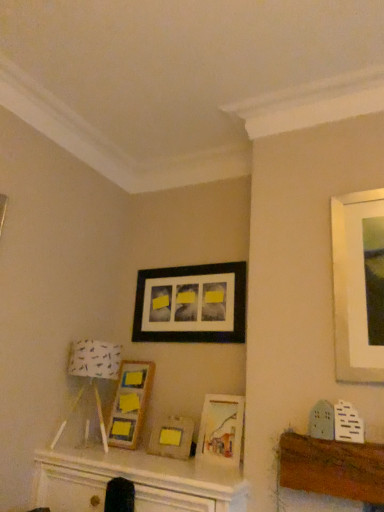
Identify the location of white fabric lampshade at left. The width and height of the screenshot is (384, 512). (91, 376).

This screenshot has height=512, width=384. Identify the location of wooden frame at center, the second picture frame positioned from the top. (130, 403).

The width and height of the screenshot is (384, 512). Describe the element at coordinates (221, 429) in the screenshot. I see `matte wooden picture frame at center, the second picture frame from the bottom` at that location.

Locate an element on the screen. The image size is (384, 512). white fabric lampshade at left is located at coordinates (91, 376).

Could you tell me if matte wooden picture frame at center, which is counted as the third picture frame, starting from the top, is turned towards black matte picture frame at upper center, which ranks as the 1th picture frame in top-to-bottom order?

No, matte wooden picture frame at center, which is counted as the third picture frame, starting from the top, is not turned towards black matte picture frame at upper center, which ranks as the 1th picture frame in top-to-bottom order.

How many degrees apart are the facing directions of matte wooden picture frame at center, the second picture frame from the bottom, and black matte picture frame at upper center, which ranks as the 4th picture frame in bottom-to-top order?

The angular difference between matte wooden picture frame at center, the second picture frame from the bottom, and black matte picture frame at upper center, which ranks as the 4th picture frame in bottom-to-top order, is 3.96 degrees.

From the image's perspective, count 2nd picture frames downward from the black matte picture frame at upper center, which ranks as the 4th picture frame in bottom-to-top order, and point to it. Please provide its 2D coordinates.

[(221, 429)]

Based on the photo, which object is further away from the camera, matte wooden picture frame at center, the second picture frame from the bottom, or black matte picture frame at upper center, which ranks as the 4th picture frame in bottom-to-top order?

black matte picture frame at upper center, which ranks as the 4th picture frame in bottom-to-top order, is behind.

Which is further, (143, 316) or (100, 361)?

The point (143, 316) is farther.

What's the angular difference between black matte picture frame at upper center, which ranks as the 4th picture frame in bottom-to-top order, and white fabric lampshade at left's facing directions?

There is a 5.44-degree angle between the facing directions of black matte picture frame at upper center, which ranks as the 4th picture frame in bottom-to-top order, and white fabric lampshade at left.

Which object is thinner, black matte picture frame at upper center, which ranks as the 4th picture frame in bottom-to-top order, or white fabric lampshade at left?

Thinner between the two is black matte picture frame at upper center, which ranks as the 4th picture frame in bottom-to-top order.

Does matte wooden picture frame at center, which is counted as the third picture frame, starting from the top, have a smaller size compared to matte silver picture frame at center, which is counted as the fourth picture frame, starting from the top?

No, matte wooden picture frame at center, which is counted as the third picture frame, starting from the top, is not smaller than matte silver picture frame at center, which is counted as the fourth picture frame, starting from the top.

Does point (205, 426) lie in front of point (155, 429)?

That is True.

Is matte wooden picture frame at center, the second picture frame from the bottom, in contact with matte silver picture frame at center, which is counted as the fourth picture frame, starting from the top?

No.

Is matte wooden picture frame at center, which is counted as the third picture frame, starting from the top, positioned with its back to matte silver picture frame at center, which is counted as the fourth picture frame, starting from the top?

No.

Is the position of white fabric lampshade at left more distant than that of matte silver picture frame at center, arranged as the first picture frame when ordered from the bottom?

No.

From the picture: Which point is more forward, (120, 356) or (150, 434)?

The point (150, 434) is closer.

Measure the distance between white fabric lampshade at left and matte silver picture frame at center, which is counted as the fourth picture frame, starting from the top.

They are 18.14 inches apart.

Is white fabric lampshade at left oriented towards matte silver picture frame at center, which is counted as the fourth picture frame, starting from the top?

No, white fabric lampshade at left is not turned towards matte silver picture frame at center, which is counted as the fourth picture frame, starting from the top.

Is black matte picture frame at upper center, which ranks as the 1th picture frame in top-to-bottom order, oriented towards matte wooden picture frame at center, which is counted as the third picture frame, starting from the top?

No, black matte picture frame at upper center, which ranks as the 1th picture frame in top-to-bottom order, is not aimed at matte wooden picture frame at center, which is counted as the third picture frame, starting from the top.

Locate an element on the screen. The height and width of the screenshot is (512, 384). the 3rd picture frame behind the matte wooden picture frame at center, which is counted as the third picture frame, starting from the top is located at coordinates (191, 304).

Between black matte picture frame at upper center, which ranks as the 1th picture frame in top-to-bottom order, and matte wooden picture frame at center, the second picture frame from the bottom, which one has larger size?

black matte picture frame at upper center, which ranks as the 1th picture frame in top-to-bottom order.

Is point (105, 429) closer or farther from the camera than point (121, 379)?

Clearly, point (105, 429) is closer to the camera than point (121, 379).

From a real-world perspective, which object rests below the other?

wooden frame at center, the second picture frame positioned from the top, is physically lower.

Can you confirm if white fabric lampshade at left is wider than wooden frame at center, the third picture frame from the bottom?

Indeed, white fabric lampshade at left has a greater width compared to wooden frame at center, the third picture frame from the bottom.

Which of these two, black matte picture frame at upper center, which ranks as the 4th picture frame in bottom-to-top order, or matte silver picture frame at center, which is counted as the fourth picture frame, starting from the top, is smaller?

With smaller size is matte silver picture frame at center, which is counted as the fourth picture frame, starting from the top.

Which is in front, point (238, 320) or point (152, 433)?

Point (152, 433)

Would you say black matte picture frame at upper center, which ranks as the 1th picture frame in top-to-bottom order, is outside matte silver picture frame at center, arranged as the first picture frame when ordered from the bottom?

black matte picture frame at upper center, which ranks as the 1th picture frame in top-to-bottom order, is positioned outside matte silver picture frame at center, arranged as the first picture frame when ordered from the bottom.

What's the angular difference between black matte picture frame at upper center, which ranks as the 4th picture frame in bottom-to-top order, and matte silver picture frame at center, arranged as the first picture frame when ordered from the bottom,'s facing directions?

black matte picture frame at upper center, which ranks as the 4th picture frame in bottom-to-top order, and matte silver picture frame at center, arranged as the first picture frame when ordered from the bottom, are facing 3.52 degrees away from each other.

Which picture frame is the 3rd one when counting from the back of the matte wooden picture frame at center, which is counted as the third picture frame, starting from the top? Please provide its 2D coordinates.

[(191, 304)]

Where is `picture frame above the white fabric lampshade at left (from the image's perspective)`? picture frame above the white fabric lampshade at left (from the image's perspective) is located at coordinates (191, 304).

Looking at the image, which one is located closer to matte silver picture frame at center, which is counted as the fourth picture frame, starting from the top, matte wooden picture frame at center, which is counted as the third picture frame, starting from the top, or black matte picture frame at upper center, which ranks as the 4th picture frame in bottom-to-top order?

Based on the image, matte wooden picture frame at center, which is counted as the third picture frame, starting from the top, appears to be nearer to matte silver picture frame at center, which is counted as the fourth picture frame, starting from the top.

From the image, which object appears to be farther from wooden frame at center, the second picture frame positioned from the top, white fabric lampshade at left or black matte picture frame at upper center, which ranks as the 1th picture frame in top-to-bottom order?

Among the two, black matte picture frame at upper center, which ranks as the 1th picture frame in top-to-bottom order, is located further to wooden frame at center, the second picture frame positioned from the top.

Based on their spatial positions, is white fabric lampshade at left or matte wooden picture frame at center, which is counted as the third picture frame, starting from the top, further from wooden frame at center, the second picture frame positioned from the top?

matte wooden picture frame at center, which is counted as the third picture frame, starting from the top.

Estimate the real-world distances between objects in this image. Which object is closer to matte wooden picture frame at center, the second picture frame from the bottom, wooden frame at center, the second picture frame positioned from the top, or matte silver picture frame at center, arranged as the first picture frame when ordered from the bottom?

matte silver picture frame at center, arranged as the first picture frame when ordered from the bottom, is positioned closer to the anchor matte wooden picture frame at center, the second picture frame from the bottom.

Considering their positions, is matte silver picture frame at center, arranged as the first picture frame when ordered from the bottom, positioned closer to white fabric lampshade at left than black matte picture frame at upper center, which ranks as the 1th picture frame in top-to-bottom order?

matte silver picture frame at center, arranged as the first picture frame when ordered from the bottom.

Which object lies further to the anchor point wooden frame at center, the third picture frame from the bottom, matte silver picture frame at center, which is counted as the fourth picture frame, starting from the top, or white fabric lampshade at left?

matte silver picture frame at center, which is counted as the fourth picture frame, starting from the top, is positioned further to the anchor wooden frame at center, the third picture frame from the bottom.

Considering their positions, is black matte picture frame at upper center, which ranks as the 1th picture frame in top-to-bottom order, positioned further to wooden frame at center, the second picture frame positioned from the top, than matte silver picture frame at center, arranged as the first picture frame when ordered from the bottom?

Based on the image, black matte picture frame at upper center, which ranks as the 1th picture frame in top-to-bottom order, appears to be further to wooden frame at center, the second picture frame positioned from the top.

From the image, which object appears to be nearer to black matte picture frame at upper center, which ranks as the 1th picture frame in top-to-bottom order, wooden frame at center, the third picture frame from the bottom, or white fabric lampshade at left?

Among the two, wooden frame at center, the third picture frame from the bottom, is located nearer to black matte picture frame at upper center, which ranks as the 1th picture frame in top-to-bottom order.

Image resolution: width=384 pixels, height=512 pixels. Identify the location of lamp between black matte picture frame at upper center, which ranks as the 4th picture frame in bottom-to-top order, and wooden frame at center, the second picture frame positioned from the top, in the vertical direction. tap(91, 376).

At what (x,y) coordinates should I click in order to perform the action: click on lamp that lies between black matte picture frame at upper center, which ranks as the 4th picture frame in bottom-to-top order, and matte silver picture frame at center, which is counted as the fourth picture frame, starting from the top, from top to bottom. Please return your answer as a coordinate pair (x, y). This screenshot has width=384, height=512. Looking at the image, I should click on (91, 376).

The height and width of the screenshot is (512, 384). Find the location of `picture frame situated between white fabric lampshade at left and matte silver picture frame at center, arranged as the first picture frame when ordered from the bottom, from left to right`. picture frame situated between white fabric lampshade at left and matte silver picture frame at center, arranged as the first picture frame when ordered from the bottom, from left to right is located at coordinates (130, 403).

This screenshot has height=512, width=384. I want to click on picture frame between black matte picture frame at upper center, which ranks as the 4th picture frame in bottom-to-top order, and matte wooden picture frame at center, the second picture frame from the bottom, in the up-down direction, so click(x=130, y=403).